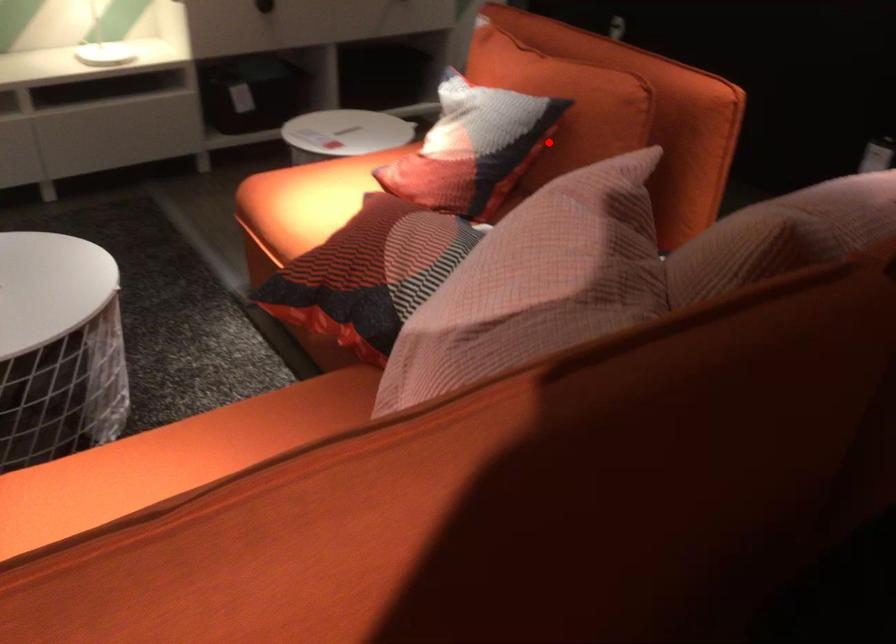
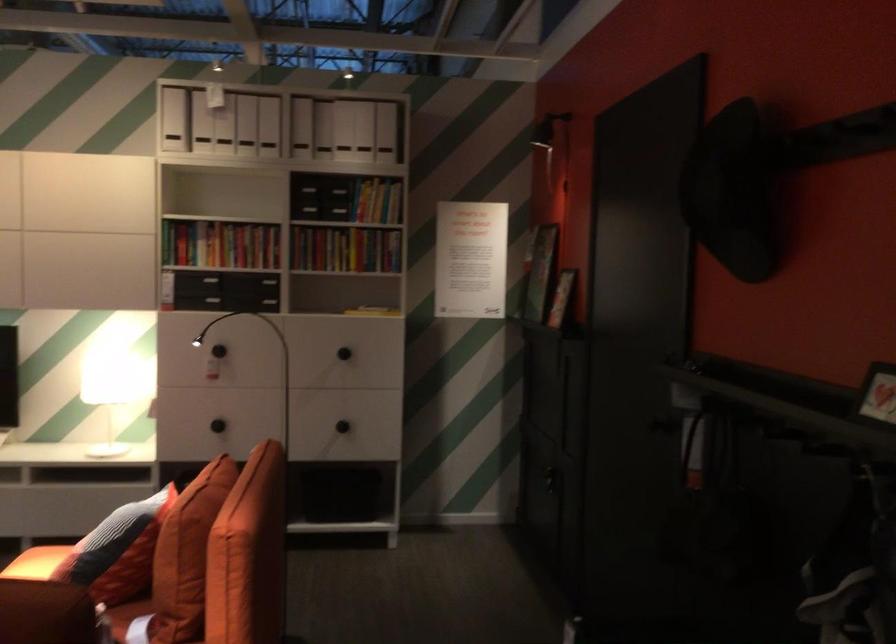
Question: I am providing you with two images of the same scene from different viewpoints. Given a red point in image1, look at the same physical point in image2. Is it:

Choices:
 (A) Closer to the viewpoint
 (B) Farther from the viewpoint

Answer: (B)